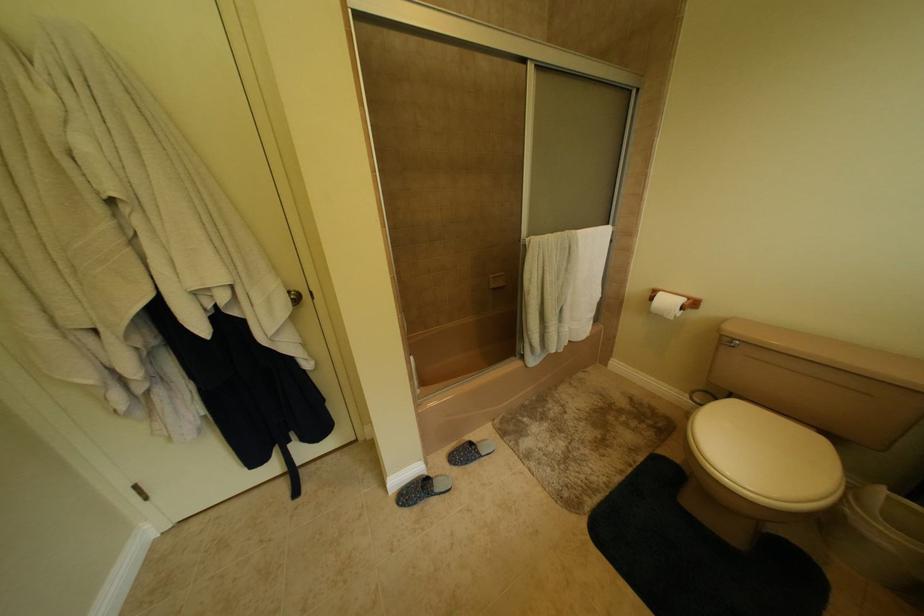
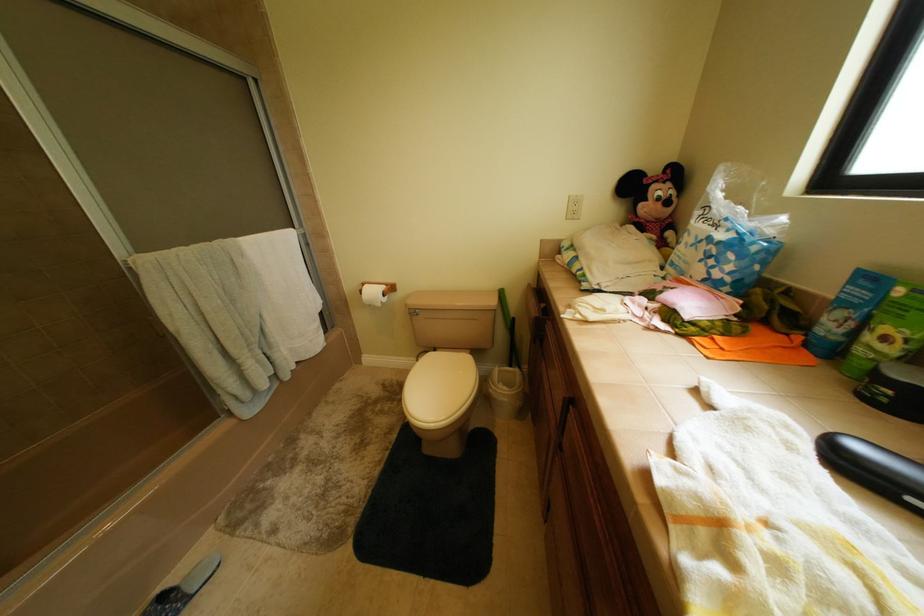
Question: The camera is either moving clockwise (left) or counter-clockwise (right) around the object. The first image is from the beginning of the video and the second image is from the end. Is the camera moving left or right when shooting the video?

Choices:
 (A) Left
 (B) Right

Answer: (A)